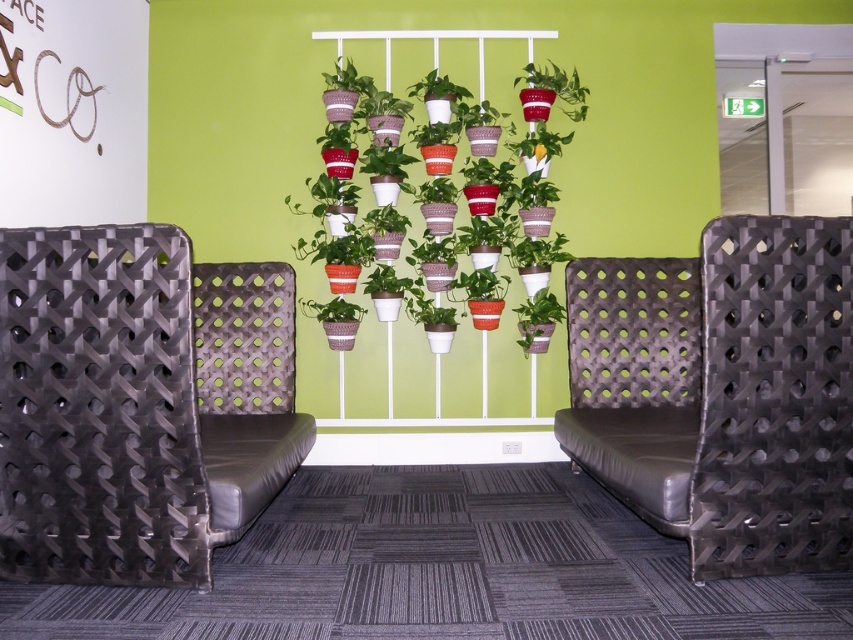
Question: Can you confirm if matte red pot at upper center is thinner than green matte plant at center?

Choices:
 (A) no
 (B) yes

Answer: (A)

Question: Among these objects, which one is farthest from the camera?

Choices:
 (A) matte red pot at upper center
 (B) green matte plant at center
 (C) black leather chair at center
 (D) black woven fabric chair at left

Answer: (A)

Question: Which object is closer to the camera taking this photo?

Choices:
 (A) matte red pot at upper center
 (B) black woven fabric chair at left

Answer: (B)

Question: Can you confirm if matte red pot at upper center is thinner than green matte plant at center?

Choices:
 (A) yes
 (B) no

Answer: (B)

Question: Which point appears farthest from the camera in this image?

Choices:
 (A) (556, 74)
 (B) (525, 314)
 (C) (722, 349)

Answer: (A)

Question: Does black woven fabric chair at left have a greater width compared to green matte plant at center?

Choices:
 (A) no
 (B) yes

Answer: (B)